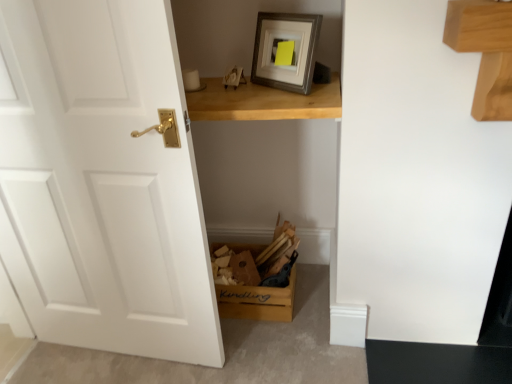
Question: Considering the positions of white matte door at left and light brown wooden table at upper center in the image, is white matte door at left taller or shorter than light brown wooden table at upper center?

Choices:
 (A) tall
 (B) short

Answer: (A)

Question: Is white matte door at left in front of or behind light brown wooden table at upper center in the image?

Choices:
 (A) front
 (B) behind

Answer: (A)

Question: Considering the real-world distances, which object is farthest from the light brown wooden table at upper center?

Choices:
 (A) white matte door at left
 (B) wooden kindling box at lower center

Answer: (B)

Question: Based on their relative distances, which object is farther from the white matte door at left?

Choices:
 (A) wooden kindling box at lower center
 (B) light brown wooden table at upper center

Answer: (A)